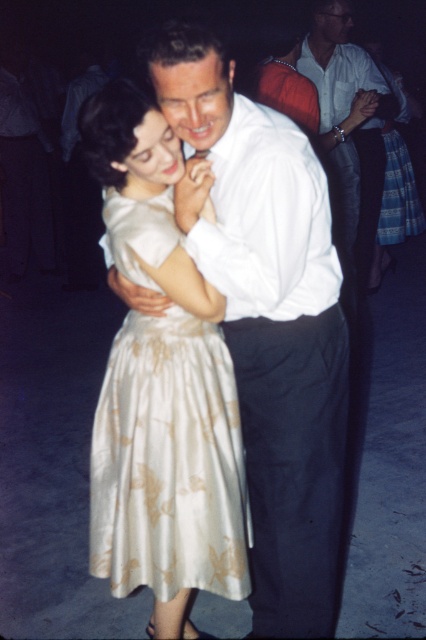
You are standing at the edge of the dance floor and see the point marked at coordinates point (178, 412). Can you reach that point without moving past the dance floor? The dance floor is 2 meters wide.

The point (178, 412) is 1.78 meters away from you, which is within the 2 meters width of the dance floor. Therefore, you can reach that point without moving past the dance floor.

You are a photographer at the event and want to capture a photo of both the white satin dress at center and the white smooth shirt at upper center. Which one is more to the left in the image?

The white satin dress at center is more to the left in the image because it is positioned on the left side of the white smooth shirt at upper center.

You are standing at the point with coordinates point (344, 24) and want to move to the point with coordinates point (114, 397). Is the destination point in front of or behind you?

The point (114, 397) is in front of point (344, 24), so the destination point is in front of you.